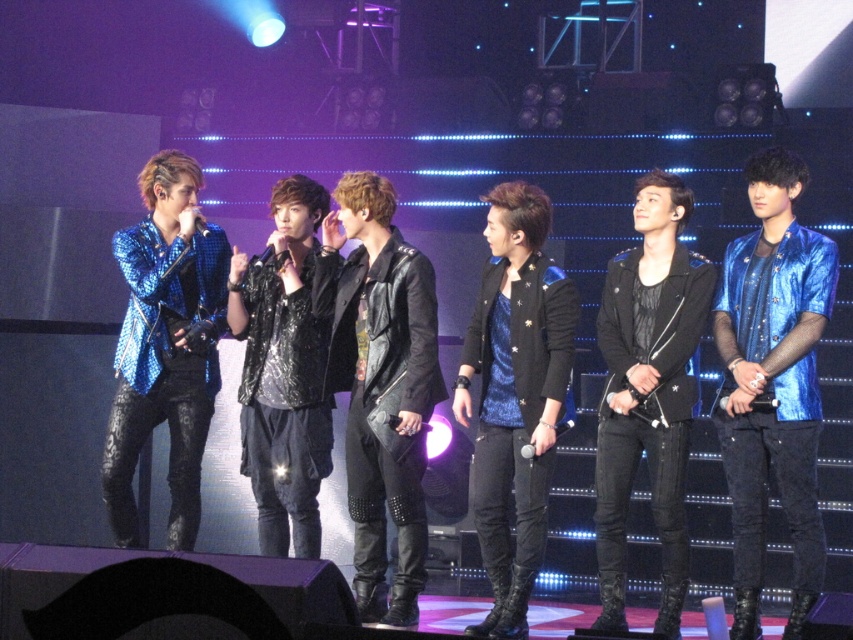
Question: Is shiny metallic jacket at left bigger than sequined black jacket at center?

Choices:
 (A) yes
 (B) no

Answer: (B)

Question: Does leather jacket at center have a larger size compared to metallic blue jacket at center?

Choices:
 (A) yes
 (B) no

Answer: (B)

Question: Which point is closer to the camera?

Choices:
 (A) (500, 595)
 (B) (408, 440)
 (C) (820, 534)

Answer: (C)

Question: Is shiny blue jacket at center smaller than black leather jacket at center?

Choices:
 (A) yes
 (B) no

Answer: (B)

Question: Which of the following is the farthest from the observer?

Choices:
 (A) (138, 184)
 (B) (283, 477)
 (C) (418, 508)

Answer: (A)

Question: Which point is farther from the camera taking this photo?

Choices:
 (A) (531, 211)
 (B) (665, 428)
 (C) (314, 307)

Answer: (C)